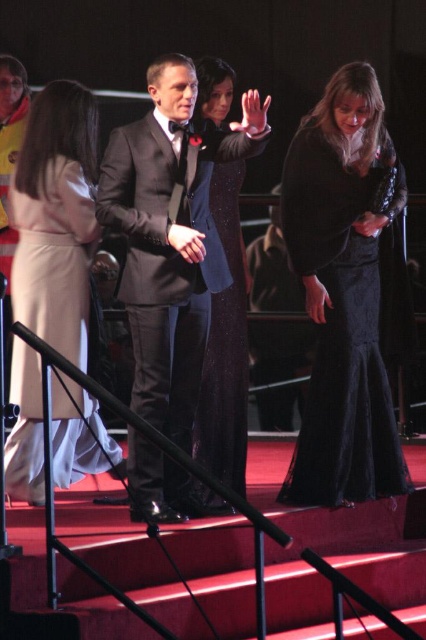
You are a photographer at the event and need to capture a group photo of the sparkly black dress at center and the dark brown leather jacket at center. The camera you are using has a maximum focus range of 1.5 meters. Can you take a clear photo of both subjects without moving the camera?

The distance between the sparkly black dress at center and the dark brown leather jacket at center is 1.68 meters, which exceeds the camera maximum focus range of 1.5 meters. Therefore, the photographer cannot take a clear photo of both subjects without moving the camera.

Based on the scene description, which object is positioned higher in the image between the shiny black suit at center and the dark brown leather jacket at center?

The shiny black suit at center is positioned higher than the dark brown leather jacket at center according to the description.

You are a photographer standing at the front of the stage. You want to take a photo that includes both point (141, 168) and point (77, 355). Which point will appear larger in the photo?

Point (141, 168) is closer to the camera than point (77, 355), so it will appear larger in the photo.